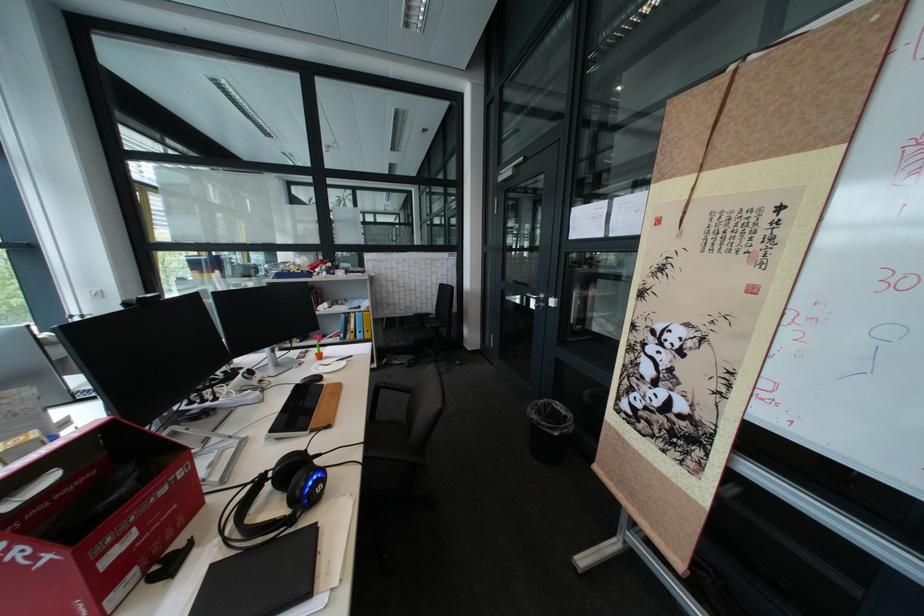
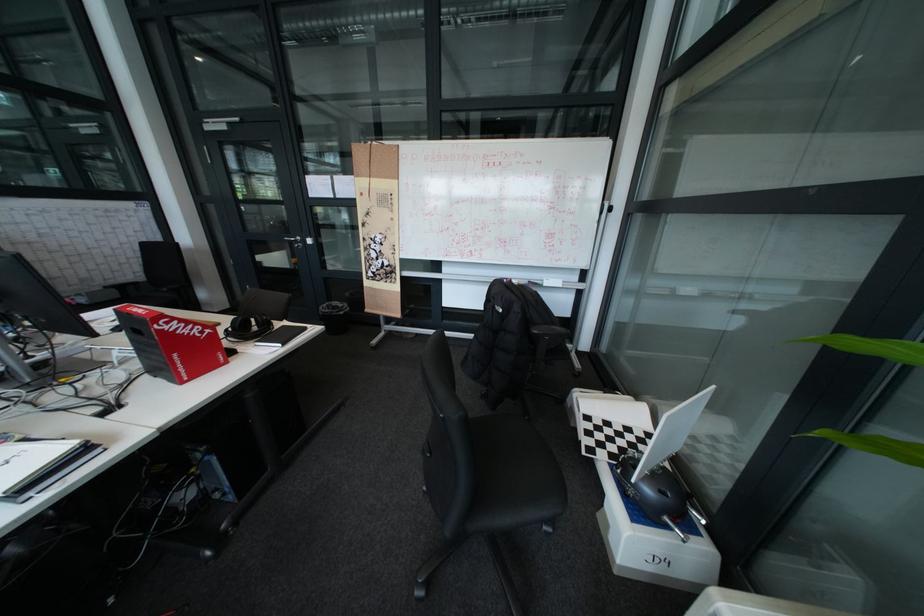
Find the pixel in the second image that matches [560,400] in the first image.

(341, 304)